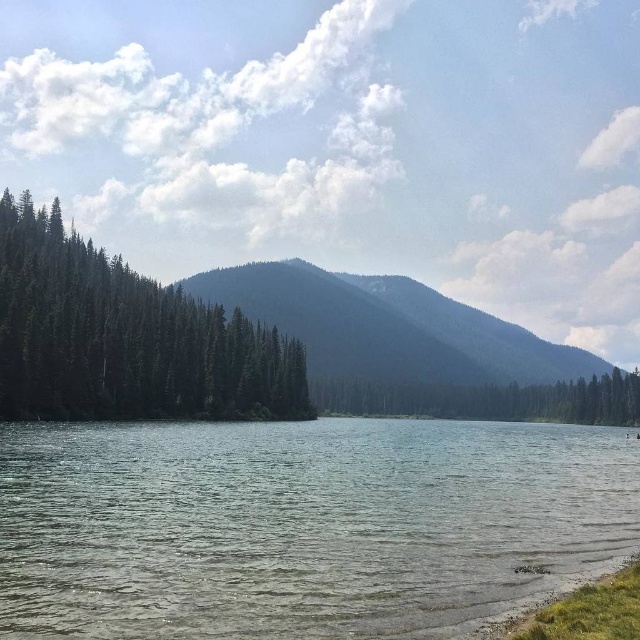
Is the position of clear water at lower center less distant than that of green textured mountain at center?

Yes, clear water at lower center is closer to the viewer.

Where is `clear water at lower center`? The width and height of the screenshot is (640, 640). clear water at lower center is located at coordinates (301, 524).

Does clear water at lower center have a greater height compared to green matte trees at left?

No.

Does clear water at lower center appear over green matte trees at left?

Actually, clear water at lower center is below green matte trees at left.

Which is in front, point (241, 557) or point (253, 394)?

Point (241, 557) is more forward.

Where is `clear water at lower center`? clear water at lower center is located at coordinates (301, 524).

Based on the photo, who is more forward, (131, 387) or (204, 275)?

Positioned in front is point (131, 387).

What do you see at coordinates (125, 339) in the screenshot? I see `green matte trees at left` at bounding box center [125, 339].

Find the location of a particular element. This screenshot has width=640, height=640. green matte trees at left is located at coordinates (125, 339).